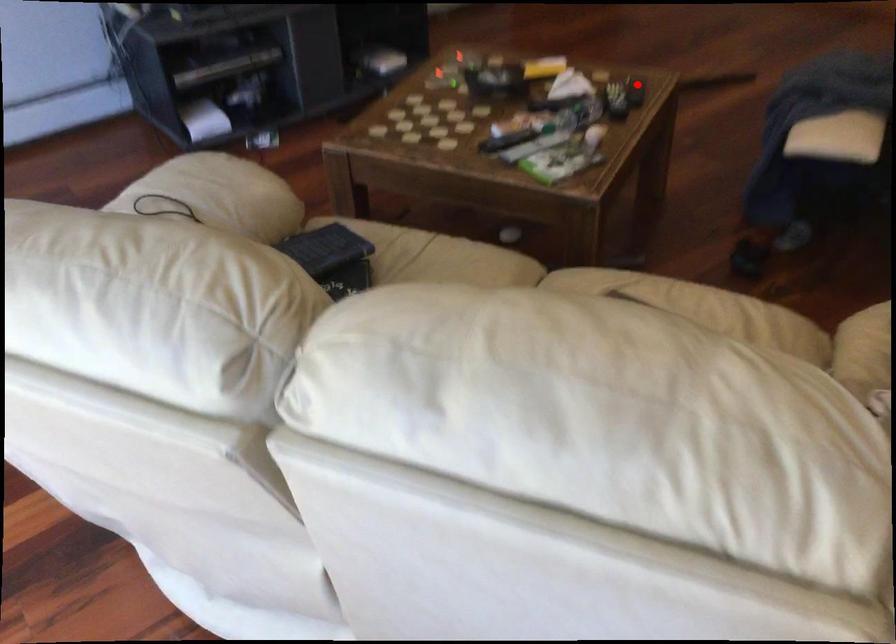
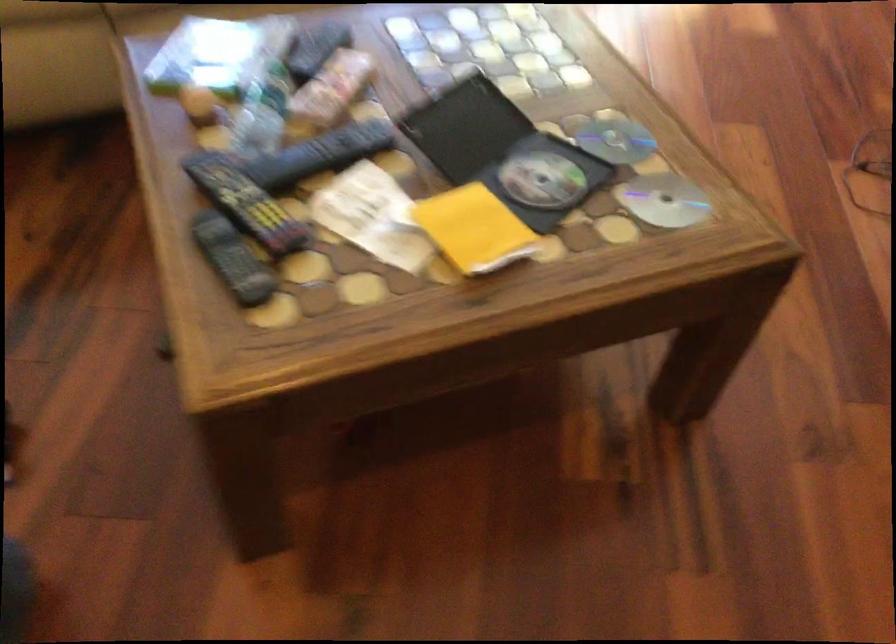
In the second image, find the point that corresponds to the highlighted location in the first image.

(233, 259)